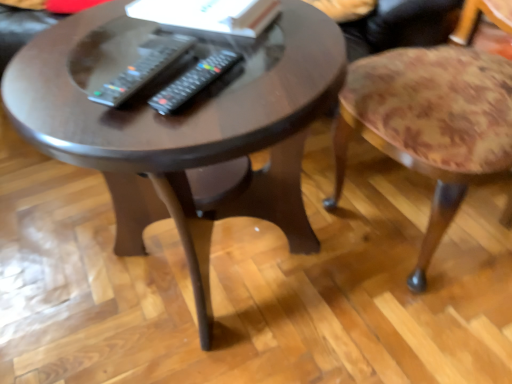
The image size is (512, 384). In order to click on vacant area that lies between dark wood coffee table at center and floral fabric stool at right in this screenshot , I will do `click(344, 252)`.